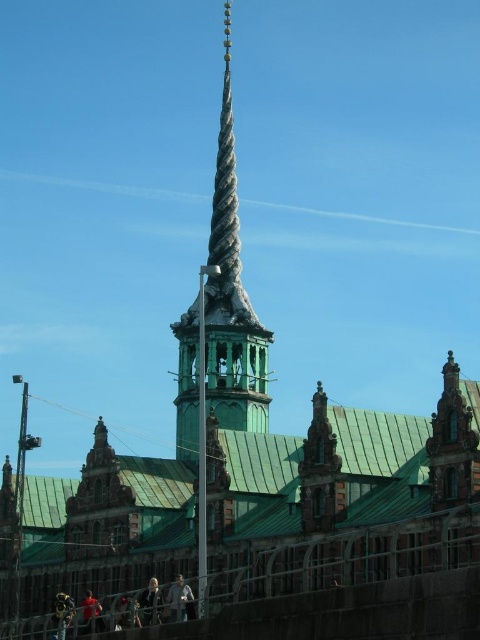
Measure the distance between point (363, 492) and camera.

Point (363, 492) is 83.68 meters away from camera.

Does green copper roof at center appear under green wooden spire at center?

Yes.

Is point (227, 500) closer to viewer compared to point (210, 381)?

Yes, it is in front of point (210, 381).

The height and width of the screenshot is (640, 480). Find the location of `green copper roof at center`. green copper roof at center is located at coordinates (109, 506).